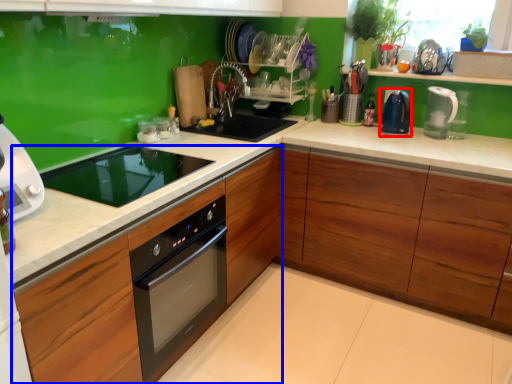
Question: Which object appears farthest to the camera in this image, kitchen appliance (highlighted by a red box) or cabinetry (highlighted by a blue box)?

Choices:
 (A) kitchen appliance
 (B) cabinetry

Answer: (A)